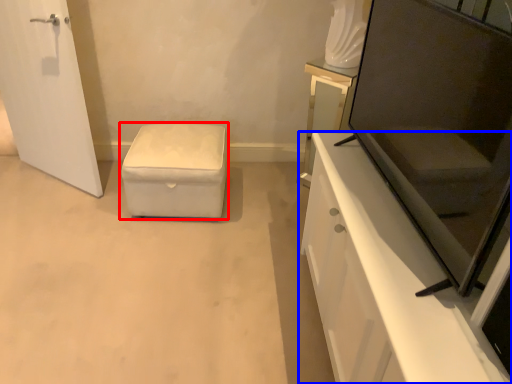
Question: Which object appears farthest to the camera in this image, furniture (highlighted by a red box) or cabinetry (highlighted by a blue box)?

Choices:
 (A) furniture
 (B) cabinetry

Answer: (A)